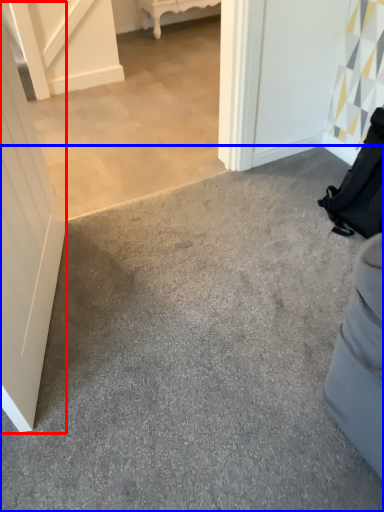
Question: Among these objects, which one is farthest to the camera, door (highlighted by a red box) or concrete (highlighted by a blue box)?

Choices:
 (A) door
 (B) concrete

Answer: (B)